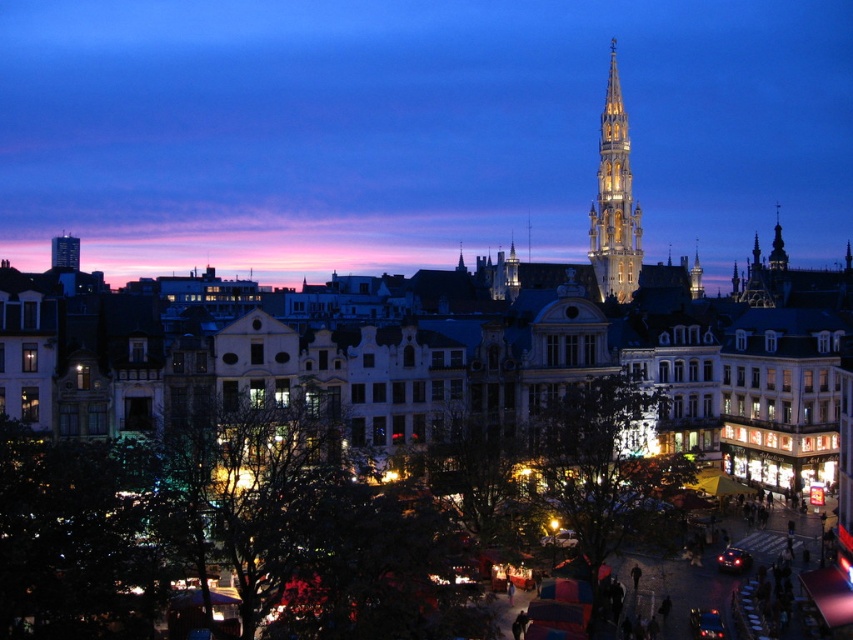
Does matte stone tower at upper center appear over illuminated stone spire at upper right?

Correct, matte stone tower at upper center is located above illuminated stone spire at upper right.

Who is shorter, matte stone tower at upper center or illuminated stone spire at upper right?

illuminated stone spire at upper right

Does point (840, 208) come closer to viewer compared to point (636, 276)?

No, (840, 208) is further to viewer.

Locate an element on the screen. matte stone tower at upper center is located at coordinates (415, 131).